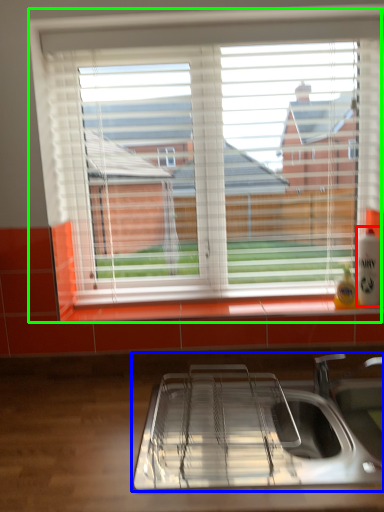
Question: Which object is positioned closest to beverage (highlighted by a red box)? Select from sink (highlighted by a blue box) and window (highlighted by a green box).

Choices:
 (A) sink
 (B) window

Answer: (A)